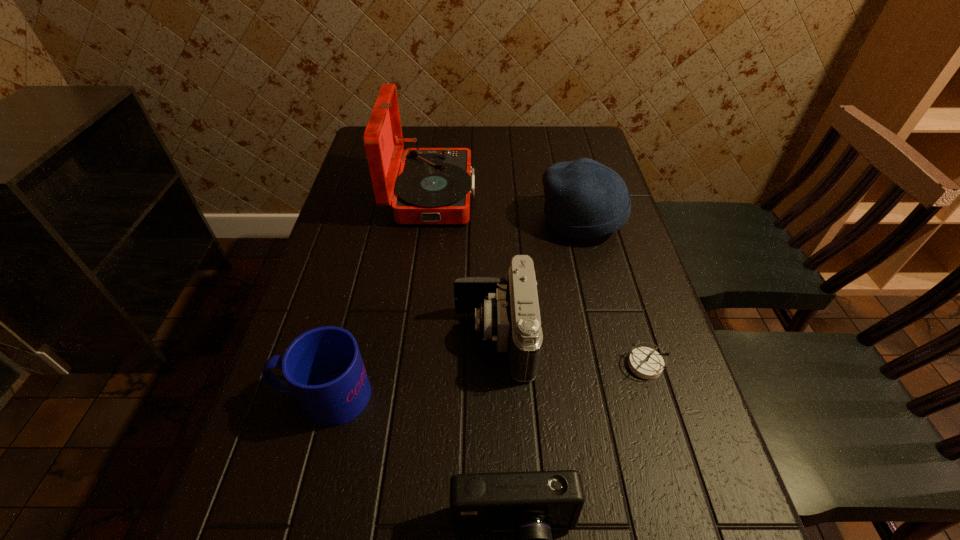
Where is `the tallest object`? the tallest object is located at coordinates (434, 185).

At what (x,y) coordinates should I click in order to perform the action: click on skullcap. Please return your answer as a coordinate pair (x, y). This screenshot has height=540, width=960. Looking at the image, I should click on (584, 199).

Image resolution: width=960 pixels, height=540 pixels. I want to click on the farther camera, so click(508, 312).

Locate an element on the screen. This screenshot has height=540, width=960. mug is located at coordinates (323, 367).

Locate an element on the screen. This screenshot has width=960, height=540. the shortest object is located at coordinates (646, 363).

Image resolution: width=960 pixels, height=540 pixels. Identify the location of vacant space located 0.300m on the front-facing side of the phonograph_record. (579, 194).

Identify the location of vacant space located 0.090m on the left of the skullcap. The image size is (960, 540). (506, 221).

Locate an element on the screen. This screenshot has height=540, width=960. vacant space located 0.110m at the front of the taller camera with an open lens cover is located at coordinates pyautogui.click(x=401, y=338).

Locate an element on the screen. This screenshot has height=540, width=960. vacant region located 0.110m at the front of the taller camera with an open lens cover is located at coordinates (401, 338).

Where is `vacant space located at the front of the taller camera with an open lens cover`? vacant space located at the front of the taller camera with an open lens cover is located at coordinates (430, 338).